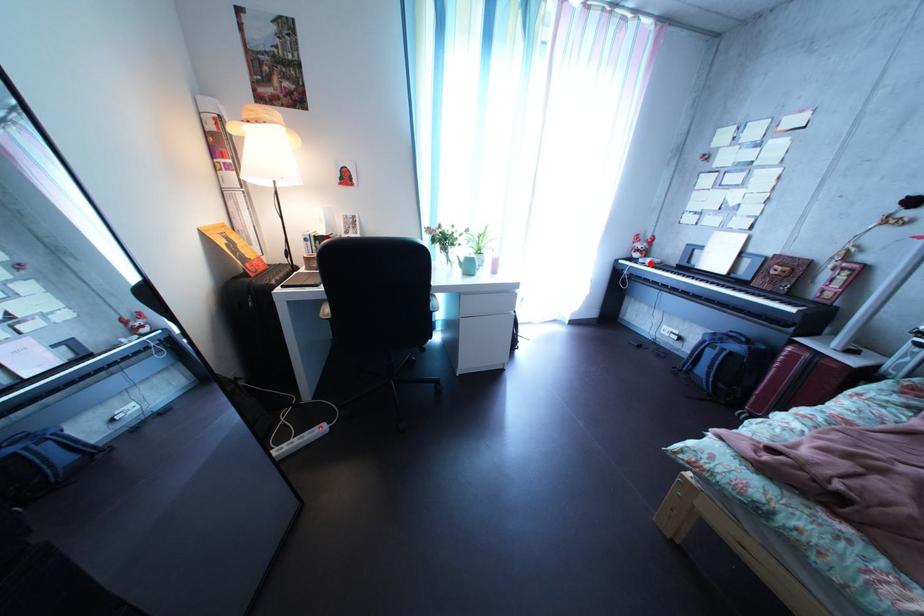
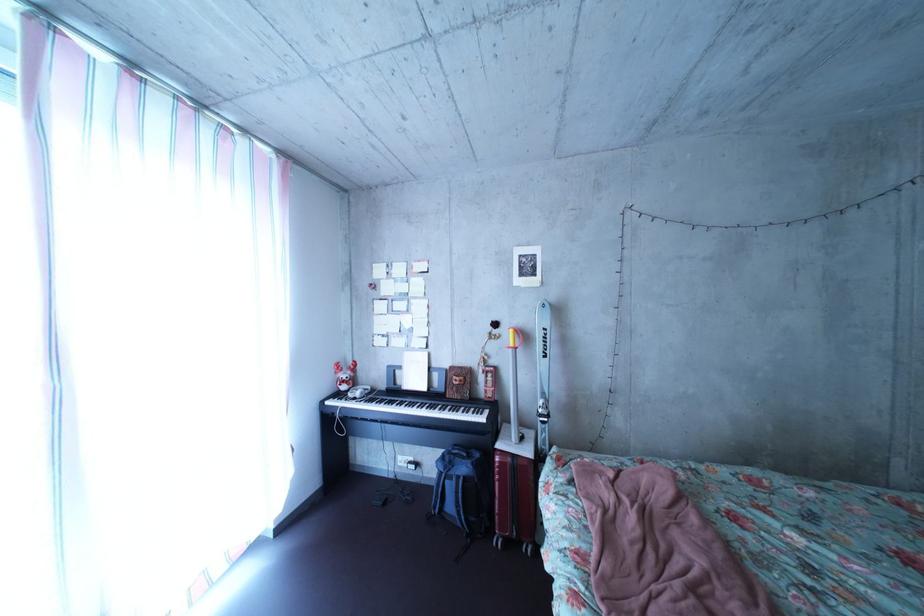
Find the pixel in the second image that matches the highlighted location in the first image.

(358, 395)